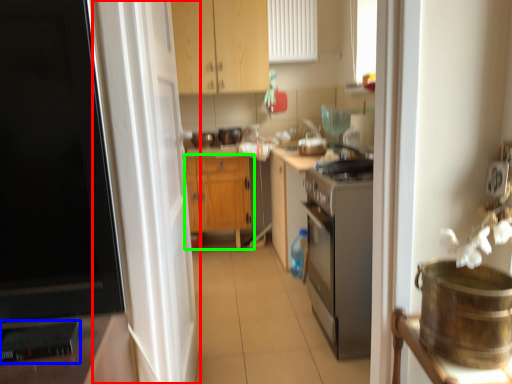
Question: Which object is the farthest from screen door (highlighted by a red box)? Choose among these: appliance (highlighted by a blue box) or cabinetry (highlighted by a green box).

Choices:
 (A) appliance
 (B) cabinetry

Answer: (B)